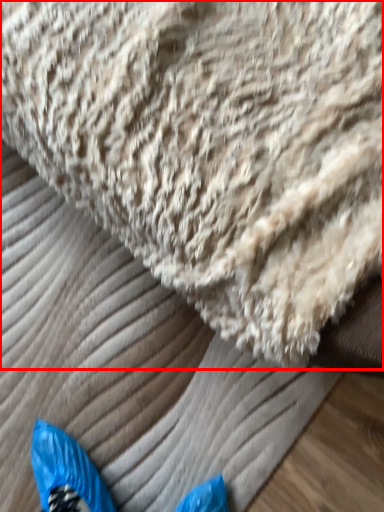
Question: Considering the relative positions of towel (annotated by the red box) and sheet in the image provided, where is towel (annotated by the red box) located with respect to the staircase?

Choices:
 (A) right
 (B) left

Answer: (A)